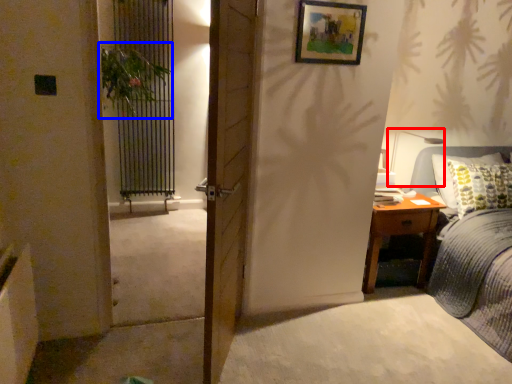
Question: Which object is further to the camera taking this photo, table lamp (highlighted by a red box) or plant (highlighted by a blue box)?

Choices:
 (A) table lamp
 (B) plant

Answer: (A)